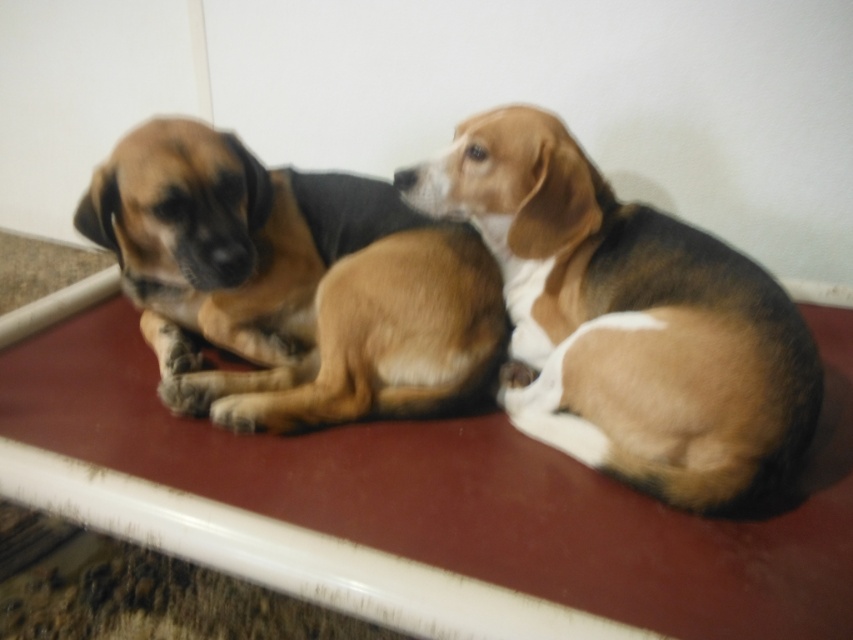
Question: Which of the following is the farthest from the observer?

Choices:
 (A) (289, 252)
 (B) (770, 324)

Answer: (A)

Question: Is tri-colored fur dog at center wider than brown fur dog at left?

Choices:
 (A) yes
 (B) no

Answer: (B)

Question: Does tri-colored fur dog at center appear on the left side of brown fur dog at left?

Choices:
 (A) no
 (B) yes

Answer: (A)

Question: Can you confirm if tri-colored fur dog at center is bigger than brown fur dog at left?

Choices:
 (A) no
 (B) yes

Answer: (B)